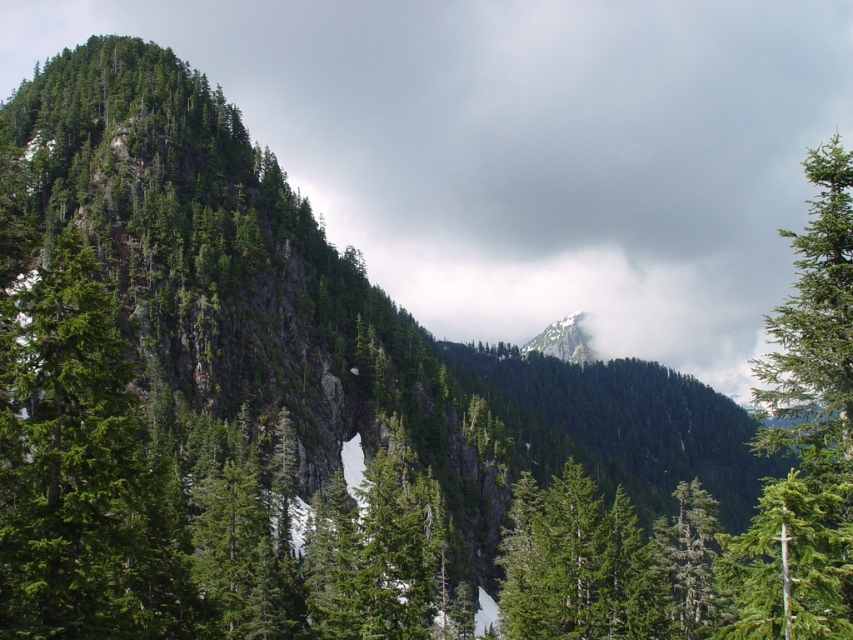
You are an environmental scientist studying the growth patterns of trees in mountainous regions. You observe the green matte tree at right and the green matte tree at center in the image. Which tree would you expect to have a wider canopy based on their positions in the landscape?

The green matte tree at right is larger in size than the green matte tree at center, so it likely has a wider canopy.

You are standing in the mountain landscape and see the green matte tree at right and the green matte tree at center. Which tree is positioned more to the east if the sun is setting in the west?

The green matte tree at right is positioned to the right of the green matte tree at center. Since the sun is setting in the west, the right side of the image corresponds to the east direction. Therefore, the green matte tree at right is more to the east.

You are a hiker standing in the mountain landscape. You see the white fluffy cloud at upper center. Can you estimate its position using the coordinate system where the bottom left corner is the origin point?

The white fluffy cloud at upper center is located at coordinate point 0.234 along the horizontal axis and 0.620 along the vertical axis.